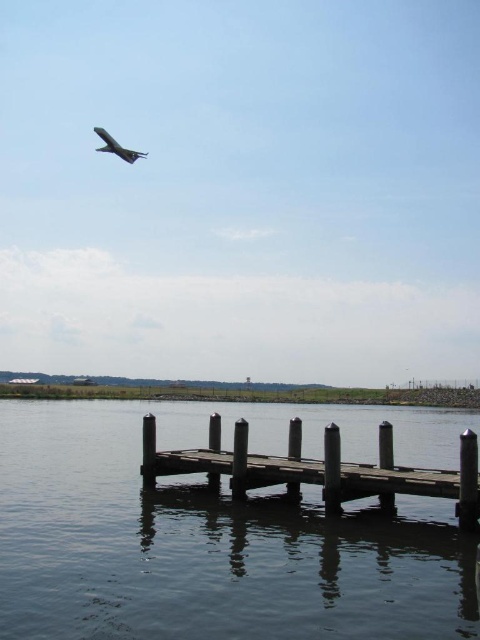
Question: Based on their relative distances, which object is nearer to the wooden dock at center?

Choices:
 (A) metallic silver airplane at upper left
 (B) smooth wooden dock at lower center

Answer: (B)

Question: Can you confirm if smooth wooden dock at lower center is thinner than metallic silver airplane at upper left?

Choices:
 (A) no
 (B) yes

Answer: (A)

Question: Does smooth wooden dock at lower center lie behind wooden dock at center?

Choices:
 (A) no
 (B) yes

Answer: (A)

Question: Which object is the closest to the wooden dock at center?

Choices:
 (A) smooth wooden dock at lower center
 (B) metallic silver airplane at upper left

Answer: (A)

Question: Does wooden dock at center appear on the right side of metallic silver airplane at upper left?

Choices:
 (A) no
 (B) yes

Answer: (B)

Question: Which object appears farthest from the camera in this image?

Choices:
 (A) smooth wooden dock at lower center
 (B) wooden dock at center

Answer: (B)